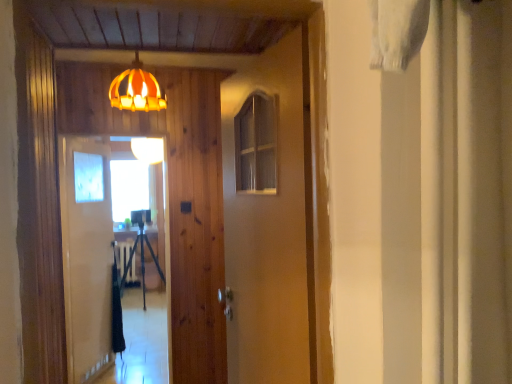
Question: Would you say dark green fabric at center is a long distance from clear glass screen door at center, the second screen door viewed from the back?

Choices:
 (A) yes
 (B) no

Answer: (B)

Question: Is dark green fabric at center aimed at clear glass screen door at center, placed as the first screen door when sorted from front to back?

Choices:
 (A) no
 (B) yes

Answer: (A)

Question: Is dark green fabric at center beside clear glass screen door at center, the second screen door viewed from the back?

Choices:
 (A) no
 (B) yes

Answer: (A)

Question: Is dark green fabric at center located outside clear glass screen door at center, the second screen door viewed from the back?

Choices:
 (A) yes
 (B) no

Answer: (A)

Question: Is dark green fabric at center in front of clear glass screen door at center, the second screen door viewed from the back?

Choices:
 (A) yes
 (B) no

Answer: (B)

Question: From a real-world perspective, is dark green fabric at center positioned under clear glass screen door at center, placed as the first screen door when sorted from front to back, based on gravity?

Choices:
 (A) yes
 (B) no

Answer: (A)

Question: Is clear glass screen door at center, the second screen door viewed from the back, positioned far away from matte orange lampshade at upper center, arranged as the 2th lamp when viewed from the back?

Choices:
 (A) yes
 (B) no

Answer: (A)

Question: Is clear glass screen door at center, the second screen door viewed from the back, bigger than matte orange lampshade at upper center, arranged as the first lamp when viewed from the front?

Choices:
 (A) yes
 (B) no

Answer: (A)

Question: From the image's perspective, is clear glass screen door at center, placed as the first screen door when sorted from front to back, located above matte orange lampshade at upper center, arranged as the 2th lamp when viewed from the back?

Choices:
 (A) no
 (B) yes

Answer: (A)

Question: Could you tell me if clear glass screen door at center, the second screen door viewed from the back, is facing matte orange lampshade at upper center, arranged as the first lamp when viewed from the front?

Choices:
 (A) no
 (B) yes

Answer: (B)

Question: Is clear glass screen door at center, the second screen door viewed from the back, completely or partially outside of matte orange lampshade at upper center, arranged as the first lamp when viewed from the front?

Choices:
 (A) yes
 (B) no

Answer: (A)

Question: Does clear glass screen door at center, the second screen door viewed from the back, contain matte orange lampshade at upper center, arranged as the first lamp when viewed from the front?

Choices:
 (A) yes
 (B) no

Answer: (B)

Question: Is wooden barn door at center oriented away from dark green fabric at center?

Choices:
 (A) yes
 (B) no

Answer: (B)